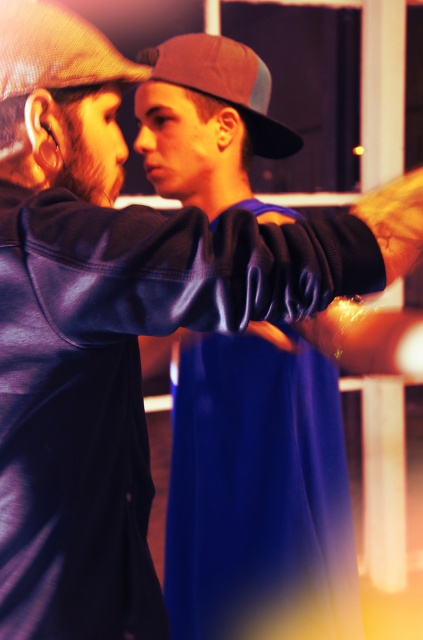
Question: Is matte brown baseball cap at upper left positioned before brown mesh baseball cap at center?

Choices:
 (A) no
 (B) yes

Answer: (B)

Question: Does matte brown baseball cap at upper left have a greater width compared to brown mesh baseball cap at center?

Choices:
 (A) no
 (B) yes

Answer: (A)

Question: Is matte brown baseball cap at upper left to the left of brown mesh baseball cap at center from the viewer's perspective?

Choices:
 (A) no
 (B) yes

Answer: (B)

Question: Which object is closer to the camera taking this photo?

Choices:
 (A) brown mesh baseball cap at center
 (B) matte brown baseball cap at upper left

Answer: (B)